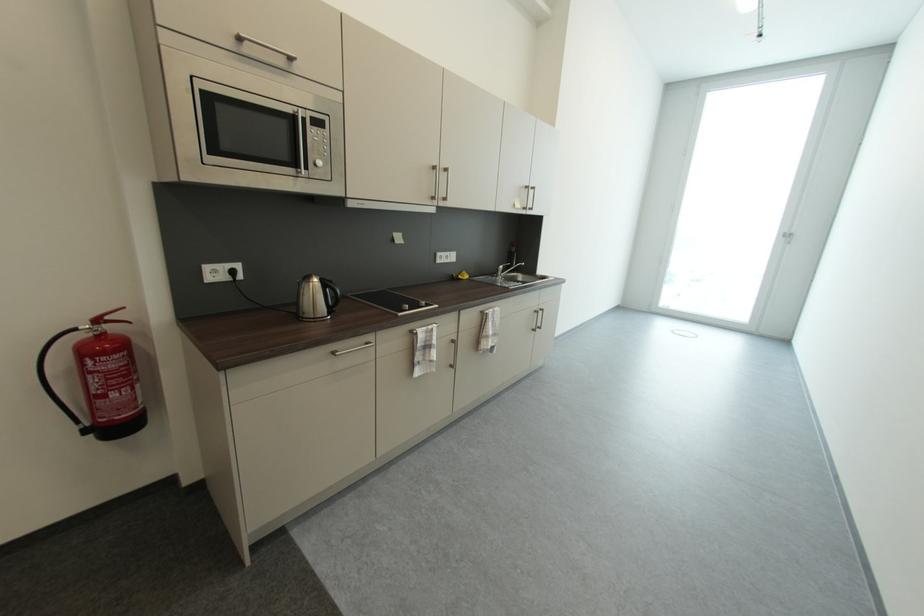
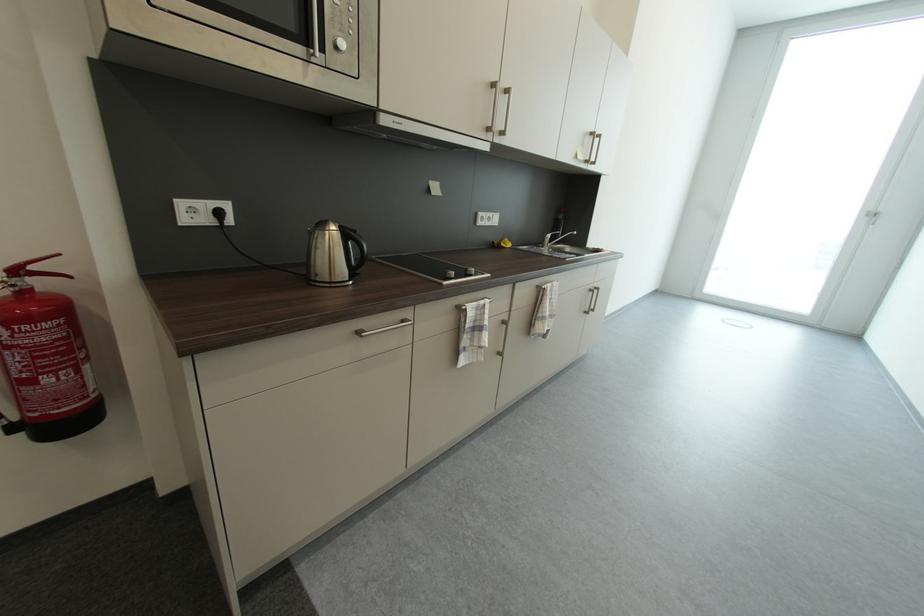
Locate, in the second image, the point that corresponds to point 412,309 in the first image.

(458, 275)